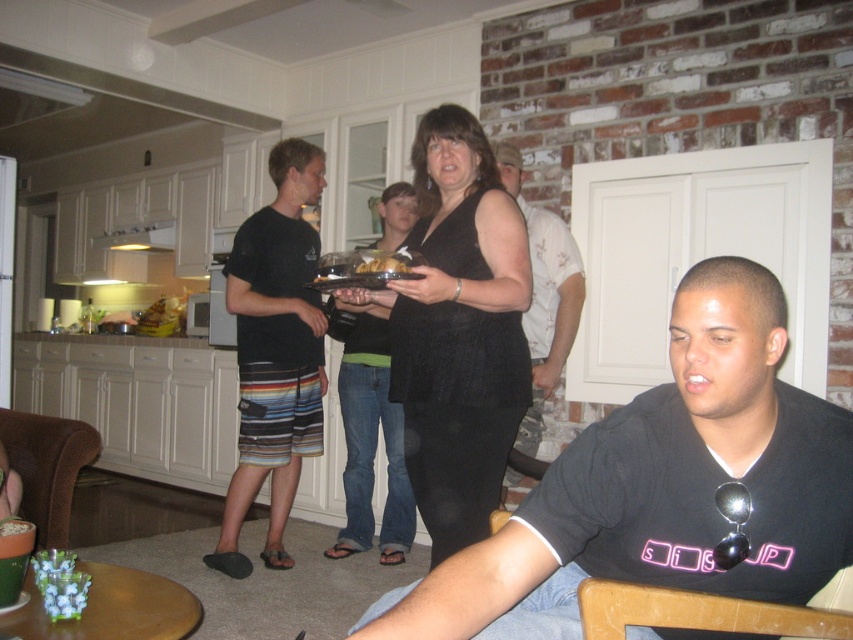
Does black striped shorts at left have a lesser width compared to matte black shirt at center?

No, black striped shorts at left is not thinner than matte black shirt at center.

Is black striped shorts at left bigger than matte black shirt at center?

Correct, black striped shorts at left is larger in size than matte black shirt at center.

Identify the location of black striped shorts at left. (276, 353).

At what (x,y) coordinates should I click in order to perform the action: click on black striped shorts at left. Please return your answer as a coordinate pair (x, y). Looking at the image, I should click on tap(276, 353).

What do you see at coordinates (663, 486) in the screenshot?
I see `black matte shirt at lower right` at bounding box center [663, 486].

Can you confirm if black matte shirt at lower right is shorter than black striped shorts at left?

Yes, black matte shirt at lower right is shorter than black striped shorts at left.

Describe the element at coordinates (663, 486) in the screenshot. The image size is (853, 640). I see `black matte shirt at lower right` at that location.

Locate an element on the screen. black matte shirt at lower right is located at coordinates (663, 486).

Between black matte vest at center and matte black shirt at center, which one appears on the right side from the viewer's perspective?

Positioned to the right is matte black shirt at center.

Measure the distance between black matte vest at center and matte black shirt at center.

black matte vest at center is 35.14 inches from matte black shirt at center.

Is point (509, 397) positioned behind point (537, 269)?

No, it is in front of (537, 269).

I want to click on black matte vest at center, so click(457, 330).